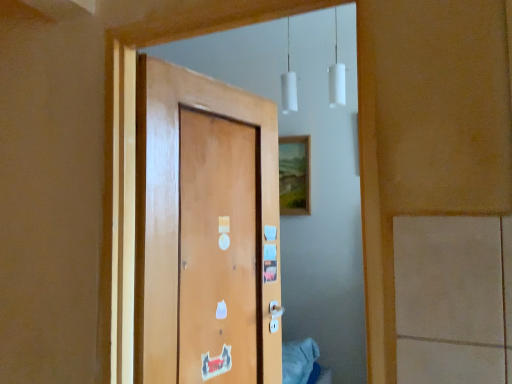
Image resolution: width=512 pixels, height=384 pixels. What do you see at coordinates (206, 231) in the screenshot? I see `wooden door at center` at bounding box center [206, 231].

In order to click on wooden door at center in this screenshot , I will do `click(206, 231)`.

This screenshot has width=512, height=384. I want to click on wooden door at center, so click(x=206, y=231).